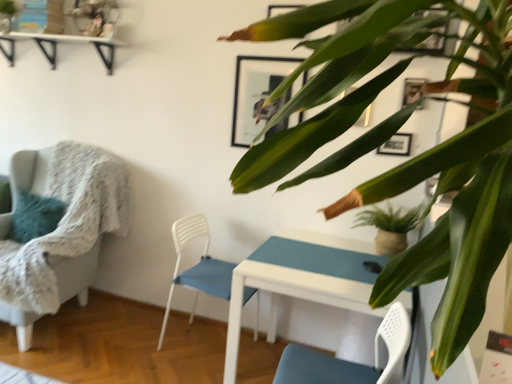
Question: Is point (236, 79) closer or farther from the camera than point (392, 213)?

Choices:
 (A) farther
 (B) closer

Answer: (A)

Question: Based on their sizes in the image, would you say matte black picture frame at upper center is bigger or smaller than green matte houseplant at center, the second houseplant when ordered from front to back?

Choices:
 (A) small
 (B) big

Answer: (A)

Question: Estimate the real-world distances between objects in this image. Which object is farther from the white glossy table at center?

Choices:
 (A) textured gray armchair at left, which appears as the second chair when viewed from the right
 (B) matte black picture frame at upper center
 (C) green matte houseplant at center, the second houseplant when ordered from front to back
 (D) green glossy leafy plant at upper right, which is counted as the second houseplant, starting from the back
 (E) white plastic chair at center, positioned as the 1th chair in right-to-left order

Answer: (D)

Question: Based on their relative distances, which object is farther from the textured gray armchair at left, which appears as the second chair when viewed from the right?

Choices:
 (A) white glossy table at center
 (B) green glossy leafy plant at upper right, positioned as the first houseplant in left-to-right order
 (C) green matte houseplant at center, marked as the second houseplant in a left-to-right arrangement
 (D) matte black picture frame at upper center
 (E) white plastic chair at center, positioned as the 1th chair in right-to-left order

Answer: (B)